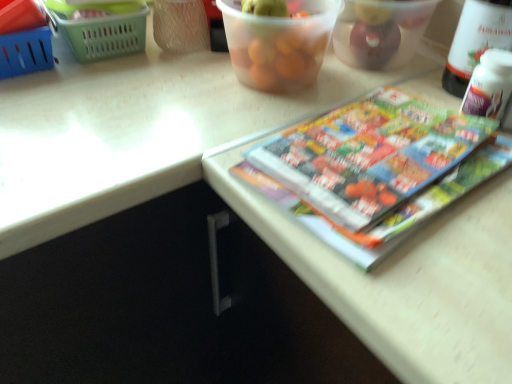
Question: From the image's perspective, relative to transparent plastic container at upper center, which appears as the 2th glass bowl when viewed from the right, is blue plastic basket at upper left, acting as the first basket starting from the left, above or below?

Choices:
 (A) above
 (B) below

Answer: (A)

Question: Considering the positions of point 4,59 and point 276,52, is point 4,59 closer or farther from the camera than point 276,52?

Choices:
 (A) closer
 (B) farther

Answer: (B)

Question: Estimate the real-world distances between objects in this image. Which object is farther from the green plastic basket at upper left, which appears as the 1th basket when viewed from the right?

Choices:
 (A) translucent plastic container at upper center, which appears as the 1th glass bowl when viewed from the right
 (B) transparent plastic container at upper center, which appears as the 2th glass bowl when viewed from the right
 (C) white plastic bottle at upper right
 (D) blue plastic basket at upper left, the 2th basket from the right
 (E) multicolored glossy book at upper right

Answer: (C)

Question: Estimate the real-world distances between objects in this image. Which object is farther from the multicolored glossy book at upper right?

Choices:
 (A) blue plastic basket at upper left, the 2th basket from the right
 (B) translucent plastic container at upper center, which appears as the 1th glass bowl when viewed from the right
 (C) green plastic basket at upper left, which appears as the 2th basket when viewed from the left
 (D) transparent plastic container at upper center, which appears as the 2th glass bowl when viewed from the right
 (E) white plastic bottle at upper right

Answer: (A)